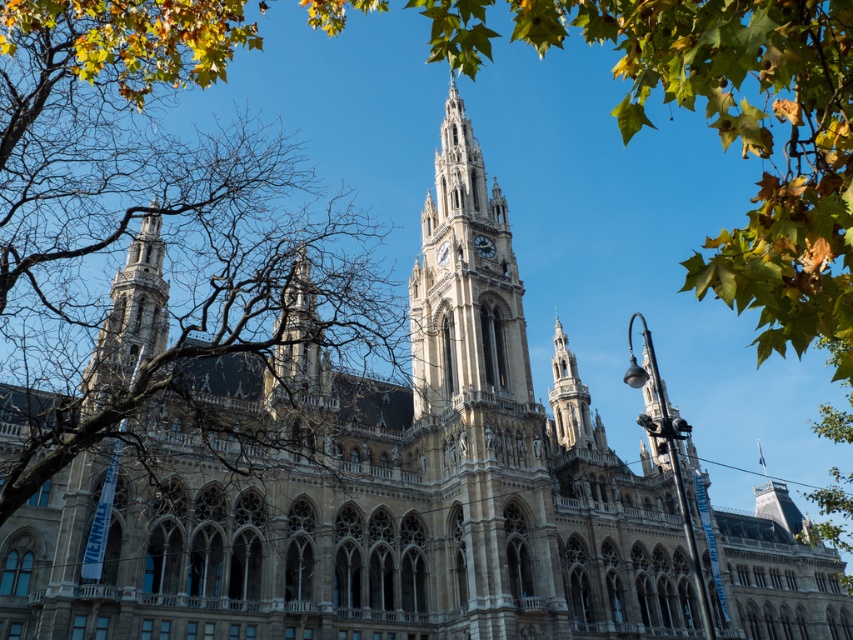
Based on the photo, you are standing in front of the grand historic building and want to take a photo that includes both the stone clock tower at center and the silver metallic clock at center. Which object will appear larger in your photo?

The stone clock tower at center will appear larger in the photo because it is closer to the viewer than the silver metallic clock at center.